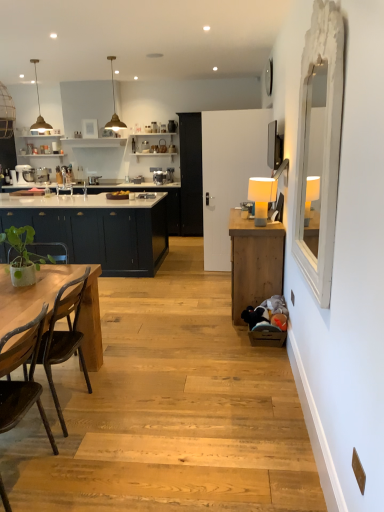
Question: Is gold metallic pendant light at upper center, positioned as the second lamp in top-to-bottom order, in front of white wooden mirror at right?

Choices:
 (A) yes
 (B) no

Answer: (B)

Question: From a real-world perspective, does gold metallic pendant light at upper center, which is the second lamp from front to back, sit lower than white wooden mirror at right?

Choices:
 (A) no
 (B) yes

Answer: (A)

Question: Is gold metallic pendant light at upper center, the second lamp from the left, taller than white wooden mirror at right?

Choices:
 (A) no
 (B) yes

Answer: (A)

Question: Is there a large distance between gold metallic pendant light at upper center, which is the second lamp from front to back, and white wooden mirror at right?

Choices:
 (A) no
 (B) yes

Answer: (B)

Question: Is the position of gold metallic pendant light at upper center, the second lamp from the left, more distant than that of white wooden mirror at right?

Choices:
 (A) no
 (B) yes

Answer: (B)

Question: Is white fabric lampshade at upper right, which is the 1th lamp in front-to-back order, taller or shorter than matte dark blue cabinets at left, the first cabinetry from the back?

Choices:
 (A) tall
 (B) short

Answer: (B)

Question: Is white fabric lampshade at upper right, which is the third lamp from back to front, to the left or to the right of matte dark blue cabinets at left, the first cabinetry from the back, in the image?

Choices:
 (A) right
 (B) left

Answer: (A)

Question: Looking at their shapes, would you say white fabric lampshade at upper right, marked as the first lamp in a right-to-left arrangement, is wider or thinner than matte dark blue cabinets at left, the first cabinetry from the back?

Choices:
 (A) thin
 (B) wide

Answer: (A)

Question: Based on their sizes in the image, would you say white fabric lampshade at upper right, marked as the first lamp in a right-to-left arrangement, is bigger or smaller than matte dark blue cabinets at left, the first cabinetry from the back?

Choices:
 (A) small
 (B) big

Answer: (A)

Question: Considering the positions of matte white sink at center and gold textured pendant light at upper left, acting as the 3th lamp starting from the front, in the image, is matte white sink at center bigger or smaller than gold textured pendant light at upper left, acting as the 3th lamp starting from the front,?

Choices:
 (A) big
 (B) small

Answer: (B)

Question: From the image's perspective, relative to gold textured pendant light at upper left, acting as the 3th lamp starting from the front, is matte white sink at center above or below?

Choices:
 (A) below
 (B) above

Answer: (A)

Question: From a real-world perspective, relative to gold textured pendant light at upper left, placed as the 3th lamp when sorted from right to left, is matte white sink at center vertically above or below?

Choices:
 (A) below
 (B) above

Answer: (A)

Question: Does point (61, 184) appear closer or farther from the camera than point (31, 61)?

Choices:
 (A) closer
 (B) farther

Answer: (B)

Question: In terms of height, does wooden cabinet at right, the 2th cabinetry in the back-to-front sequence, look taller or shorter compared to green matte plant at left?

Choices:
 (A) tall
 (B) short

Answer: (A)

Question: Looking at the image, does wooden cabinet at right, the 1th cabinetry when ordered from right to left, seem bigger or smaller compared to green matte plant at left?

Choices:
 (A) small
 (B) big

Answer: (B)